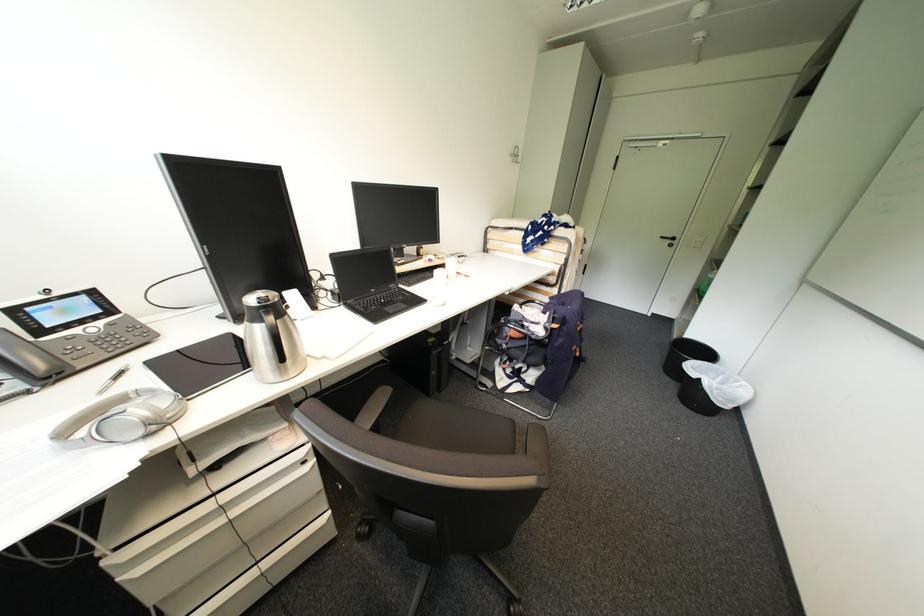
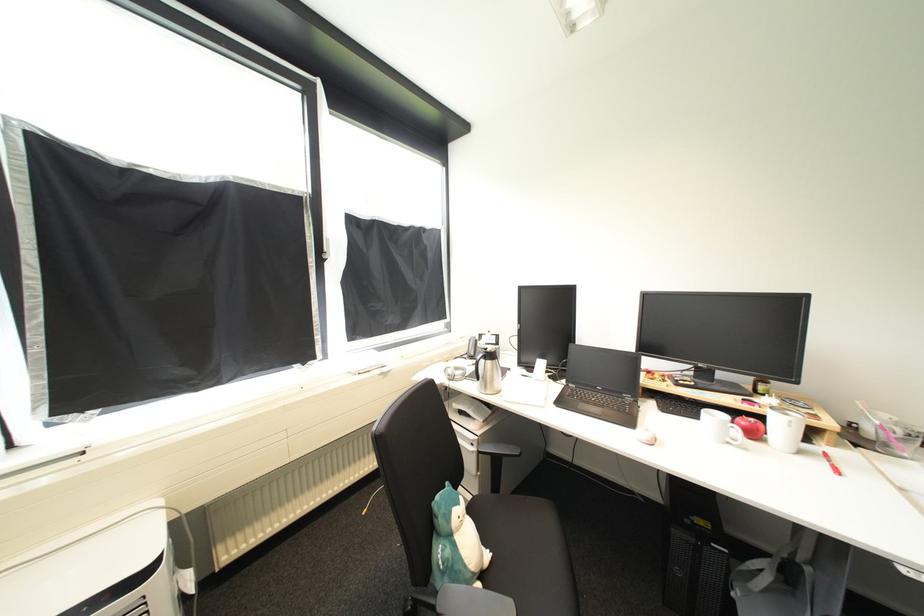
Locate, in the second image, the point that corresponds to (459,355) in the first image.

(745, 591)